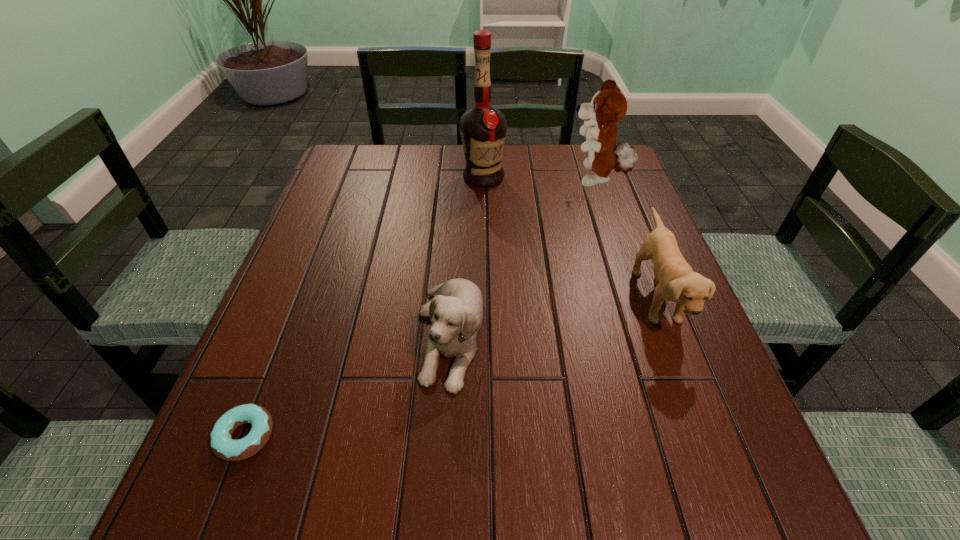
In the image, there is a desktop. Identify the location of vacant space at the far right corner. (585, 158).

Where is `free space between the doughnut and the leftmost puppy`? The width and height of the screenshot is (960, 540). free space between the doughnut and the leftmost puppy is located at coordinates (348, 385).

Locate an element on the screen. blank region between the farthest puppy and the tallest object is located at coordinates (540, 179).

This screenshot has width=960, height=540. What are the coordinates of `blank region between the tallest object and the fourth shortest object` in the screenshot? It's located at (540, 179).

The image size is (960, 540). What are the coordinates of `free space between the leftmost puppy and the tallest object` in the screenshot? It's located at pyautogui.click(x=467, y=256).

Where is `blank region between the leftmost puppy and the shortest object`? blank region between the leftmost puppy and the shortest object is located at coordinates (x=348, y=385).

You are a GUI agent. You are given a task and a screenshot of the screen. Output one action in this format:
    pyautogui.click(x=<x>, y=<y>)
    Task: Click on the free area in between the tallest object and the tallest puppy
    This screenshot has height=540, width=960.
    Given the screenshot: What is the action you would take?
    [x=540, y=179]

Identify the location of the third closest object relative to the leftmost puppy. (483, 128).

Where is `object that stands as the fourth closest to the second tallest object`? The image size is (960, 540). object that stands as the fourth closest to the second tallest object is located at coordinates (223, 446).

Select which puppy is the second closest to the leftmost puppy. Please provide its 2D coordinates. Your answer should be formatted as a tuple, i.e. [(x, y)], where the tuple contains the x and y coordinates of a point satisfying the conditions above.

[(608, 106)]